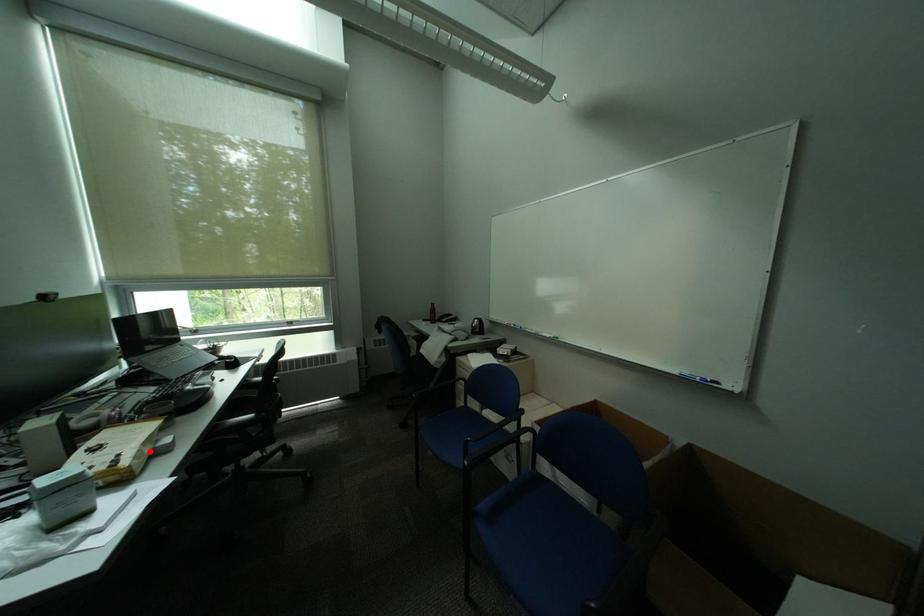
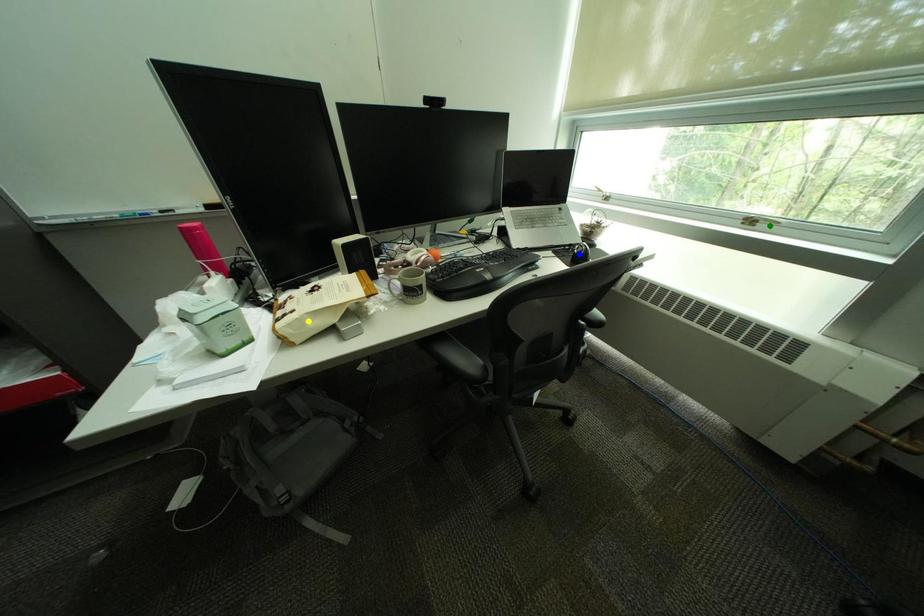
Question: I am providing you with two images of the same scene from different viewpoints. A red point is marked on the first image. You are given multiple points on the second image. Which point in image 2 is actually the same real-world point as the red point in image 1?

Choices:
 (A) yellow point
 (B) green point
 (C) blue point

Answer: (A)